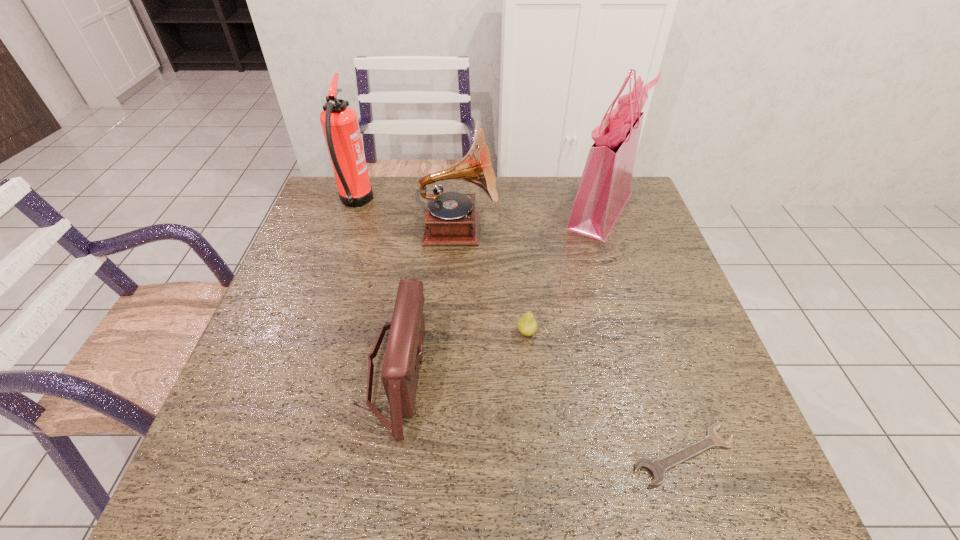
Locate an element on the screen. The height and width of the screenshot is (540, 960). free space located on the front flap of the shoulder bag is located at coordinates (458, 370).

Where is `free point located 0.200m on the left of the pear`? This screenshot has width=960, height=540. free point located 0.200m on the left of the pear is located at coordinates (432, 333).

What are the coordinates of `free space located 0.180m on the left of the wrench` in the screenshot? It's located at (534, 455).

The width and height of the screenshot is (960, 540). Find the location of `shopping bag located at the far edge`. shopping bag located at the far edge is located at coordinates (605, 186).

Image resolution: width=960 pixels, height=540 pixels. I want to click on fire extinguisher situated at the far edge, so click(x=339, y=122).

Identify the location of phonograph_record that is at the far edge. (450, 218).

The image size is (960, 540). Identify the location of object that is at the near edge. (657, 467).

Find the location of a particular element. object situated at the left edge is located at coordinates (339, 122).

Find the location of `shopping bag present at the right edge`. shopping bag present at the right edge is located at coordinates (605, 186).

Find the location of a particular element. The height and width of the screenshot is (540, 960). wrench that is at the right edge is located at coordinates tap(657, 467).